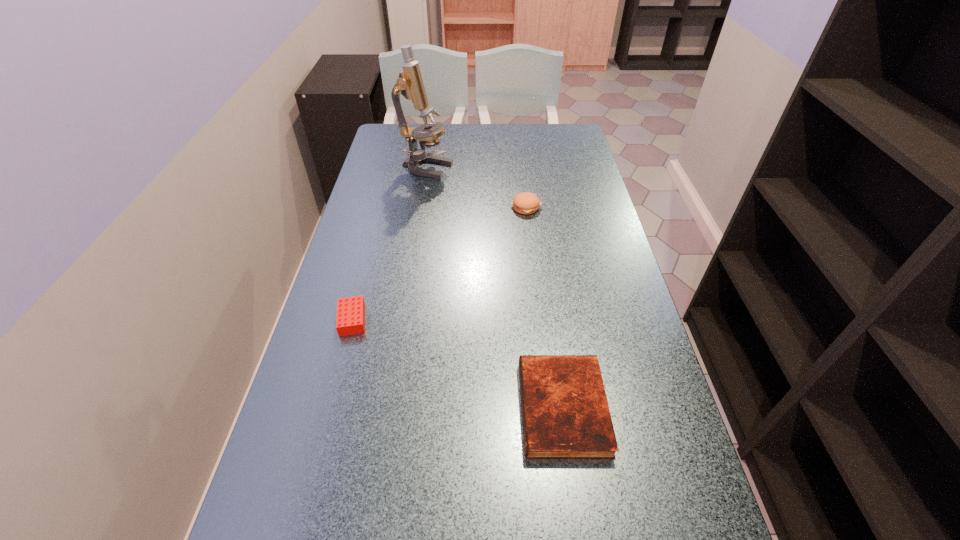
Locate an element on the screen. This screenshot has width=960, height=540. vacant space that's between the second farthest object and the Bible is located at coordinates (544, 307).

The image size is (960, 540). What are the coordinates of `vacant space that's between the farthest object and the second farthest object` in the screenshot? It's located at (476, 188).

I want to click on vacant space in between the nearest object and the Lego, so click(458, 363).

At what (x,y) coordinates should I click in order to perform the action: click on vacant area that lies between the third nearest object and the tallest object. Please return your answer as a coordinate pair (x, y). This screenshot has width=960, height=540. Looking at the image, I should click on (476, 188).

Locate an element on the screen. unoccupied area between the second nearest object and the second farthest object is located at coordinates (440, 263).

This screenshot has height=540, width=960. What are the coordinates of `free space between the Lego and the tallest object` in the screenshot? It's located at (389, 244).

You are a GUI agent. You are given a task and a screenshot of the screen. Output one action in this format:
    pyautogui.click(x=<x>, y=<y>)
    Task: Click on the empty space that is in between the Bible and the patty
    The height and width of the screenshot is (540, 960).
    Given the screenshot: What is the action you would take?
    pyautogui.click(x=544, y=307)

You are a GUI agent. You are given a task and a screenshot of the screen. Output one action in this format:
    pyautogui.click(x=<x>, y=<y>)
    Task: Click on the empty space between the patty and the Bible
    This screenshot has height=540, width=960.
    Given the screenshot: What is the action you would take?
    pyautogui.click(x=544, y=307)

This screenshot has width=960, height=540. Identify the location of vacant space that is in between the nearest object and the second nearest object. (458, 363).

Identify which object is the second nearest to the Bible. Please provide its 2D coordinates. Your answer should be formatted as a tuple, i.e. [(x, y)], where the tuple contains the x and y coordinates of a point satisfying the conditions above.

[(526, 203)]